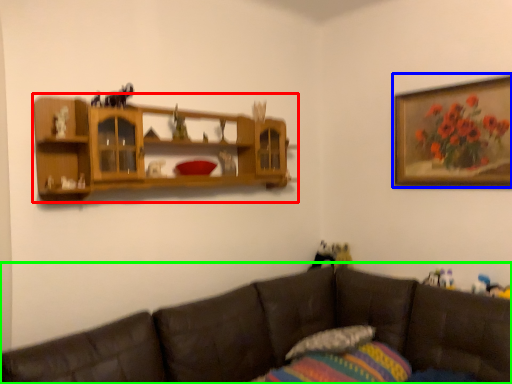
Question: Considering the real-world distances, which object is farthest from shelf (highlighted by a red box)? picture frame (highlighted by a blue box) or studio couch (highlighted by a green box)?

Choices:
 (A) picture frame
 (B) studio couch

Answer: (A)